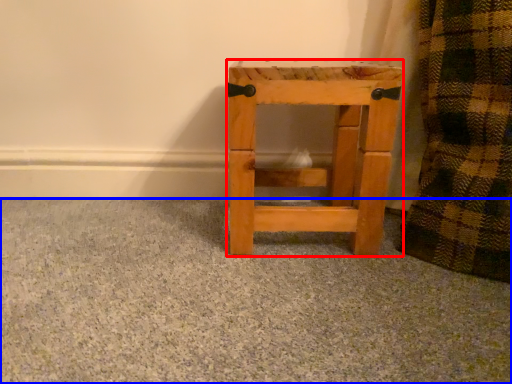
Question: Which point is closer to the camera, furniture (highlighted by a red box) or concrete (highlighted by a blue box)?

Choices:
 (A) furniture
 (B) concrete

Answer: (B)